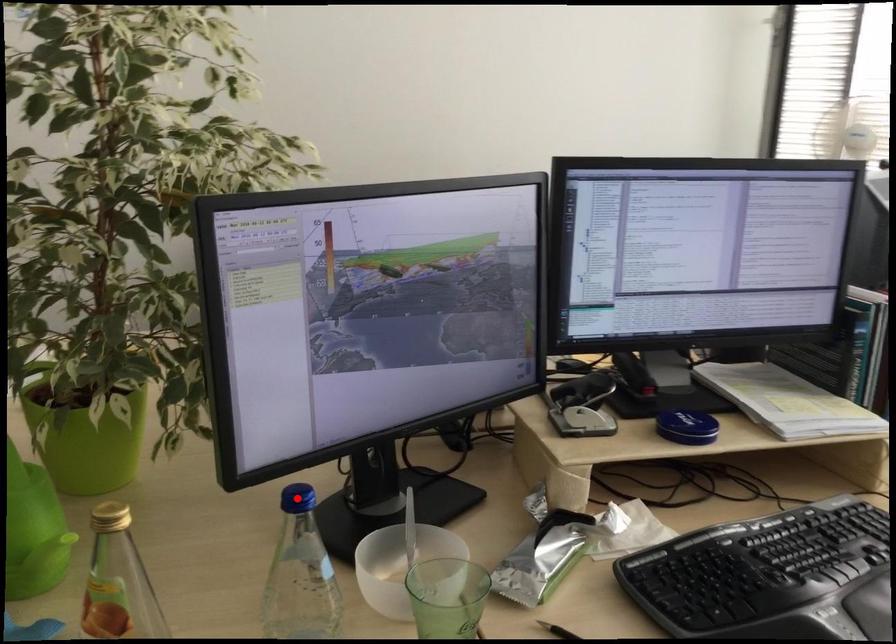
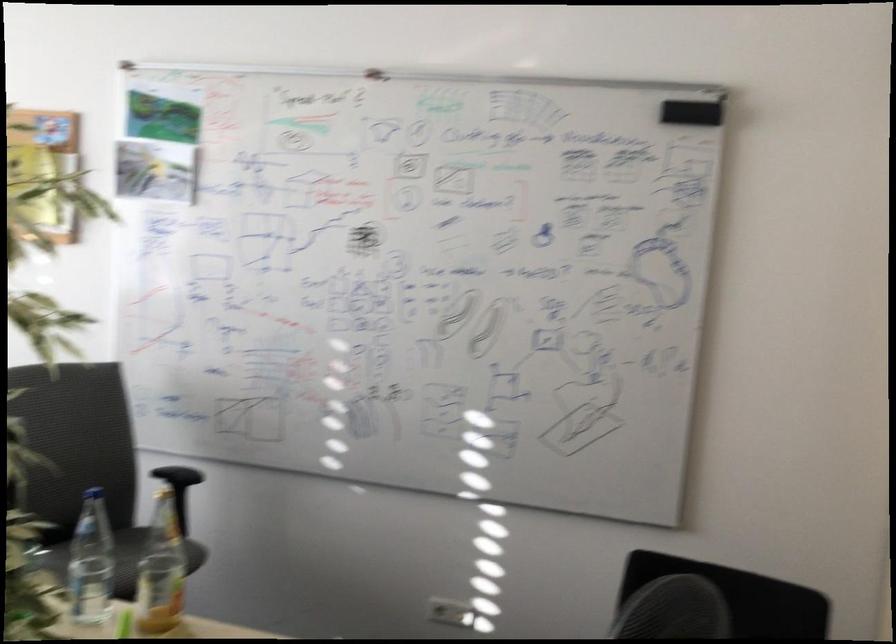
Question: I am providing you with two images of the same scene from different viewpoints. A red point is marked on the first image. Can you still see the location of the red point in image 2?

Choices:
 (A) Yes
 (B) No

Answer: (B)